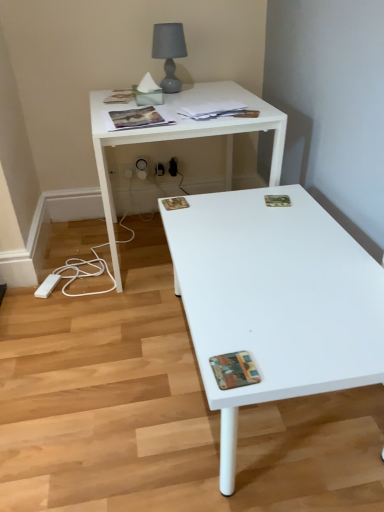
Describe the element at coordinates (120, 97) in the screenshot. I see `matte paper magazine at upper left, marked as the 1th magazine in a top-to-bottom arrangement` at that location.

How much space does matte paper magazine at upper left, acting as the sixth magazine starting from the bottom, occupy vertically?

Answer: The height of matte paper magazine at upper left, acting as the sixth magazine starting from the bottom, is 2.83 centimeters.

The image size is (384, 512). What are the coordinates of `white glossy desk at upper center` in the screenshot? It's located at (184, 138).

The height and width of the screenshot is (512, 384). What are the coordinates of `white plastic electric outlet at lower center, which is counted as the first electric outlet, starting from the left` in the screenshot? It's located at (128, 170).

At what (x,y) coordinates should I click in order to perform the action: click on matte gray lampshade at upper center. Please return your answer as a coordinate pair (x, y). This screenshot has height=512, width=384. Looking at the image, I should click on (169, 52).

What do you see at coordinates (277, 201) in the screenshot? I see `camouflage paper magazine at upper right, the 3th magazine ordered from the bottom` at bounding box center [277, 201].

Where is `printed paper magazine at center, acting as the 3th magazine starting from the front`? This screenshot has width=384, height=512. printed paper magazine at center, acting as the 3th magazine starting from the front is located at coordinates (175, 203).

Locate an element on the screen. The width and height of the screenshot is (384, 512). matte paper magazine at upper left, the 1th magazine viewed from the back is located at coordinates (120, 97).

Considering the relative positions of white plastic electric outlet at lower center, positioned as the 1th electric outlet in right-to-left order, and white matte coffee table at lower right in the image provided, is white plastic electric outlet at lower center, positioned as the 1th electric outlet in right-to-left order, to the left or to the right of white matte coffee table at lower right?

From the image, it's evident that white plastic electric outlet at lower center, positioned as the 1th electric outlet in right-to-left order, is to the left of white matte coffee table at lower right.

Is white plastic electric outlet at lower center, positioned as the 1th electric outlet in right-to-left order, taller or shorter than white matte coffee table at lower right?

white plastic electric outlet at lower center, positioned as the 1th electric outlet in right-to-left order, is taller than white matte coffee table at lower right.

Is white plastic electric outlet at lower center, the 2th electric outlet positioned from the left, positioned with its back to white matte coffee table at lower right?

No, white plastic electric outlet at lower center, the 2th electric outlet positioned from the left, is not facing away from white matte coffee table at lower right.

Is white glossy desk at upper center spatially inside white matte coffee table at lower right, or outside of it?

white glossy desk at upper center exists outside the volume of white matte coffee table at lower right.

Looking at their sizes, would you say white glossy desk at upper center is wider or thinner than white matte coffee table at lower right?

→ white glossy desk at upper center is thinner than white matte coffee table at lower right.

Considering the points (163, 133) and (256, 267), which point is behind, point (163, 133) or point (256, 267)?

Positioned behind is point (163, 133).

In terms of height, does white glossy desk at upper center look taller or shorter compared to white matte coffee table at lower right?

white glossy desk at upper center is taller than white matte coffee table at lower right.

Which object is positioned more to the left, multicolored textured magazine at lower right, acting as the first magazine starting from the front, or white plastic electric outlet at lower center, positioned as the 1th electric outlet in right-to-left order?

From the viewer's perspective, white plastic electric outlet at lower center, positioned as the 1th electric outlet in right-to-left order, appears more on the left side.

Can you confirm if multicolored textured magazine at lower right, acting as the first magazine starting from the front, is shorter than white plastic electric outlet at lower center, the 2th electric outlet positioned from the left?

Yes.

Is multicolored textured magazine at lower right, which ranks as the 6th magazine in back-to-front order, situated inside white plastic electric outlet at lower center, the 2th electric outlet positioned from the left, or outside?

multicolored textured magazine at lower right, which ranks as the 6th magazine in back-to-front order, lies outside white plastic electric outlet at lower center, the 2th electric outlet positioned from the left.

I want to click on the 1st electric outlet counting from the left of the multicolored textured magazine at lower right, positioned as the 1th magazine in bottom-to-top order, so click(x=141, y=168).

Which object is closer to the camera taking this photo, white plastic electric outlet at lower center, the 2th electric outlet positioned from the left, or white plastic electric outlet at lower center, the second electric outlet positioned from the right?

white plastic electric outlet at lower center, the 2th electric outlet positioned from the left, is in front.

Are white plastic electric outlet at lower center, the 2th electric outlet positioned from the left, and white plastic electric outlet at lower center, which is counted as the first electric outlet, starting from the left, far apart?

No, white plastic electric outlet at lower center, the 2th electric outlet positioned from the left, is not far away from white plastic electric outlet at lower center, which is counted as the first electric outlet, starting from the left.

Is white plastic electric outlet at lower center, positioned as the 1th electric outlet in right-to-left order, inside or outside of white plastic electric outlet at lower center, which is counted as the first electric outlet, starting from the left?

white plastic electric outlet at lower center, positioned as the 1th electric outlet in right-to-left order, lies outside white plastic electric outlet at lower center, which is counted as the first electric outlet, starting from the left.

How different are the orientations of white plastic electric outlet at lower center, positioned as the 1th electric outlet in right-to-left order, and white plastic electric outlet at lower center, the second electric outlet positioned from the right, in degrees?

The angular difference between white plastic electric outlet at lower center, positioned as the 1th electric outlet in right-to-left order, and white plastic electric outlet at lower center, the second electric outlet positioned from the right, is 0.00214 degrees.

Is printed paper magazine at upper center, which appears as the second magazine when viewed from the front, not near white plastic electric outlet at lower center, the 2th electric outlet positioned from the left?

printed paper magazine at upper center, which appears as the second magazine when viewed from the front, is near white plastic electric outlet at lower center, the 2th electric outlet positioned from the left, not far away.

From a real-world perspective, which object stands above the other?

printed paper magazine at upper center, which is counted as the fourth magazine, starting from the bottom, from a real-world perspective.

Who is smaller, printed paper magazine at upper center, the third magazine positioned from the top, or white plastic electric outlet at lower center, the 2th electric outlet positioned from the left?

With smaller size is white plastic electric outlet at lower center, the 2th electric outlet positioned from the left.

Considering the positions of point (144, 162) and point (231, 113), is point (144, 162) closer or farther from the camera than point (231, 113)?

Point (144, 162) is positioned farther from the camera compared to point (231, 113).

Looking at this image, how different are the orientations of white plastic electric outlet at lower center, positioned as the 1th electric outlet in right-to-left order, and matte paper magazine at upper center, the fourth magazine when ordered from front to back, in degrees?

5.93 degrees separate the facing orientations of white plastic electric outlet at lower center, positioned as the 1th electric outlet in right-to-left order, and matte paper magazine at upper center, the fourth magazine when ordered from front to back.

In the scene shown: Do you think white plastic electric outlet at lower center, positioned as the 1th electric outlet in right-to-left order, is within matte paper magazine at upper center, which ranks as the 3th magazine in back-to-front order, or outside of it?

white plastic electric outlet at lower center, positioned as the 1th electric outlet in right-to-left order, is not inside matte paper magazine at upper center, which ranks as the 3th magazine in back-to-front order, it's outside.

Is point (185, 201) closer or farther from the camera than point (124, 170)?

Point (185, 201) appears to be closer to the viewer than point (124, 170).

Is printed paper magazine at center, positioned as the 5th magazine in top-to-bottom order, spatially inside white plastic electric outlet at lower center, the second electric outlet positioned from the right, or outside of it?

printed paper magazine at center, positioned as the 5th magazine in top-to-bottom order, cannot be found inside white plastic electric outlet at lower center, the second electric outlet positioned from the right.

Can you confirm if printed paper magazine at center, acting as the 3th magazine starting from the front, is positioned to the right of white plastic electric outlet at lower center, the second electric outlet positioned from the right?

Yes.

Which of these two, printed paper magazine at center, acting as the 3th magazine starting from the front, or white plastic electric outlet at lower center, the second electric outlet positioned from the right, is wider?

Wider between the two is printed paper magazine at center, acting as the 3th magazine starting from the front.

Locate an element on the screen. coffee table lying below the white plastic electric outlet at lower center, the 2th electric outlet positioned from the left (from the image's perspective) is located at coordinates (275, 300).

At what (x,y) coordinates should I click in order to perform the action: click on desk to the right of white matte coffee table at lower right. Please return your answer as a coordinate pair (x, y). Looking at the image, I should click on (184, 138).

Looking at the image, which one is located closer to white plastic electric outlet at lower center, the second electric outlet positioned from the right, white matte coffee table at lower right or camouflage paper magazine at upper right, the fourth magazine in the top-to-bottom sequence?

camouflage paper magazine at upper right, the fourth magazine in the top-to-bottom sequence.

Which object lies nearer to the anchor point white plastic electric outlet at lower center, positioned as the 1th electric outlet in right-to-left order, matte paper magazine at upper left, marked as the 1th magazine in a top-to-bottom arrangement, or matte paper magazine at upper center, the fourth magazine when ordered from front to back?

The object closer to white plastic electric outlet at lower center, positioned as the 1th electric outlet in right-to-left order, is matte paper magazine at upper left, marked as the 1th magazine in a top-to-bottom arrangement.

Estimate the real-world distances between objects in this image. Which object is closer to multicolored textured magazine at lower right, positioned as the 1th magazine in bottom-to-top order, matte paper magazine at upper left, the 1th magazine viewed from the back, or white plastic electric outlet at lower center, which is counted as the first electric outlet, starting from the left?

matte paper magazine at upper left, the 1th magazine viewed from the back.

When comparing their distances from printed paper magazine at upper center, the 5th magazine when ordered from back to front, does camouflage paper magazine at upper right, the 3th magazine ordered from the bottom, or printed paper magazine at center, marked as the second magazine in a bottom-to-top arrangement, seem closer?

Based on the image, printed paper magazine at center, marked as the second magazine in a bottom-to-top arrangement, appears to be nearer to printed paper magazine at upper center, the 5th magazine when ordered from back to front.

When comparing their distances from printed paper magazine at upper center, which appears as the second magazine when viewed from the front, does matte paper magazine at upper center, which ranks as the 3th magazine in back-to-front order, or white plastic electric outlet at lower center, the second electric outlet positioned from the right, seem closer?

Based on the image, matte paper magazine at upper center, which ranks as the 3th magazine in back-to-front order, appears to be nearer to printed paper magazine at upper center, which appears as the second magazine when viewed from the front.

When comparing their distances from camouflage paper magazine at upper right, the 2th magazine in the back-to-front sequence, does matte paper magazine at upper center, the fifth magazine ordered from the bottom, or matte gray lampshade at upper center seem closer?

matte paper magazine at upper center, the fifth magazine ordered from the bottom, is closer to camouflage paper magazine at upper right, the 2th magazine in the back-to-front sequence.

When comparing their distances from white glossy desk at upper center, does camouflage paper magazine at upper right, the 5th magazine positioned from the front, or matte paper magazine at upper left, marked as the 1th magazine in a top-to-bottom arrangement, seem further?

camouflage paper magazine at upper right, the 5th magazine positioned from the front.

Which object lies further to the anchor point camouflage paper magazine at upper right, the 2th magazine in the back-to-front sequence, matte gray lampshade at upper center or white plastic electric outlet at lower center, the 2th electric outlet positioned from the left?

white plastic electric outlet at lower center, the 2th electric outlet positioned from the left, is further to camouflage paper magazine at upper right, the 2th magazine in the back-to-front sequence.

Where is `desk between matte paper magazine at upper center, the fourth magazine when ordered from front to back, and printed paper magazine at center, acting as the 3th magazine starting from the front, from top to bottom`? desk between matte paper magazine at upper center, the fourth magazine when ordered from front to back, and printed paper magazine at center, acting as the 3th magazine starting from the front, from top to bottom is located at coordinates (184, 138).

Find the location of a particular element. electric outlet between matte gray lampshade at upper center and white plastic electric outlet at lower center, which is counted as the first electric outlet, starting from the left, from front to back is located at coordinates (141, 168).

Locate an element on the screen. The height and width of the screenshot is (512, 384). electric outlet between camouflage paper magazine at upper right, the 5th magazine positioned from the front, and white plastic electric outlet at lower center, the second electric outlet positioned from the right, along the z-axis is located at coordinates (141, 168).

The width and height of the screenshot is (384, 512). I want to click on table lamp positioned between multicolored textured magazine at lower right, placed as the 6th magazine when sorted from top to bottom, and white plastic electric outlet at lower center, the second electric outlet positioned from the right, from near to far, so click(169, 52).